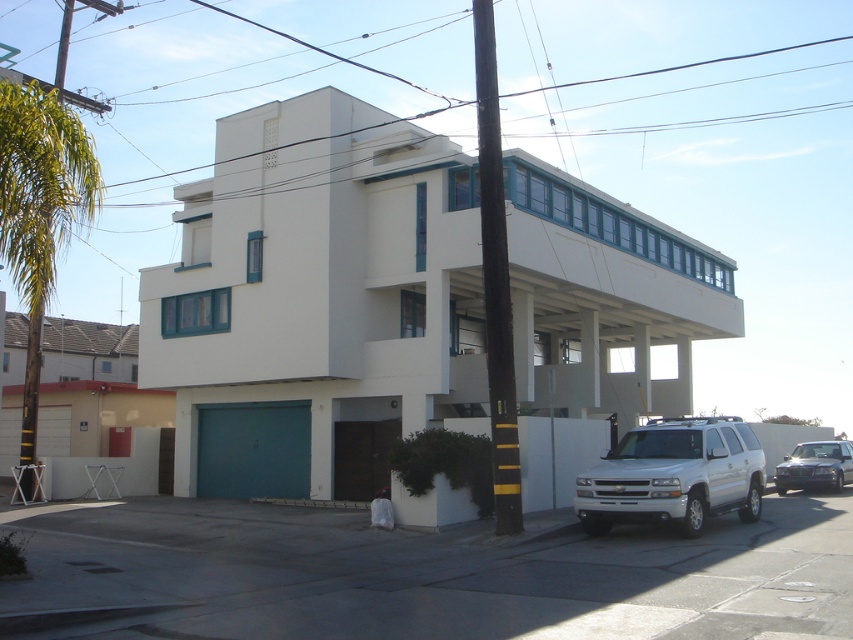
You are a delivery person needing to park your van which is 25 feet long. You see the white glossy suv at lower right and the metallic silver sedan at lower right in the driveway. Can your van fit between them?

The white glossy suv at lower right is 28.53 feet from metallic silver sedan at lower right. Since your van is 25 feet long, there is enough space between them for your van to fit.

You are standing at the entrance of the modernist building and want to park your car, which is 15 feet long. You see the white glossy suv at lower right. Is there enough space between the suv and the building entrance to park your car?

The white glossy suv at lower right is 43.60 feet from the viewer. Since the distance between the suv and the entrance is more than the car length of 15 feet, there is sufficient space to park your car.